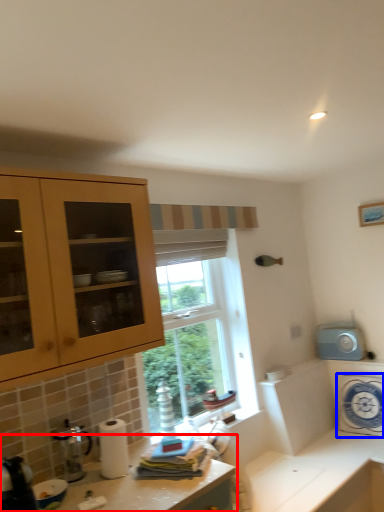
Question: Which point is closer to the camera, countertop (highlighted by a red box) or appliance (highlighted by a blue box)?

Choices:
 (A) countertop
 (B) appliance

Answer: (A)